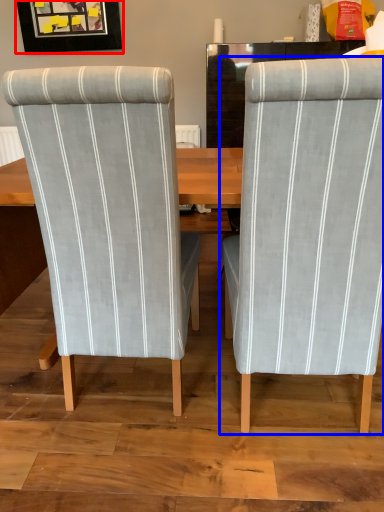
Question: Which point is closer to the camera, picture frame (highlighted by a red box) or chair (highlighted by a blue box)?

Choices:
 (A) picture frame
 (B) chair

Answer: (B)